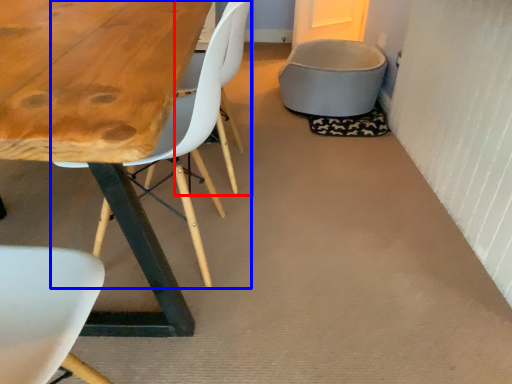
Question: Which object is further to the camera taking this photo, armchair (highlighted by a red box) or chair (highlighted by a blue box)?

Choices:
 (A) armchair
 (B) chair

Answer: (A)